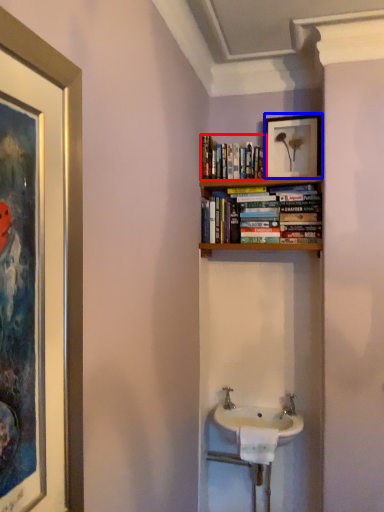
Question: Which of the following is the farthest to the observer, book (highlighted by a red box) or picture frame (highlighted by a blue box)?

Choices:
 (A) book
 (B) picture frame

Answer: (B)